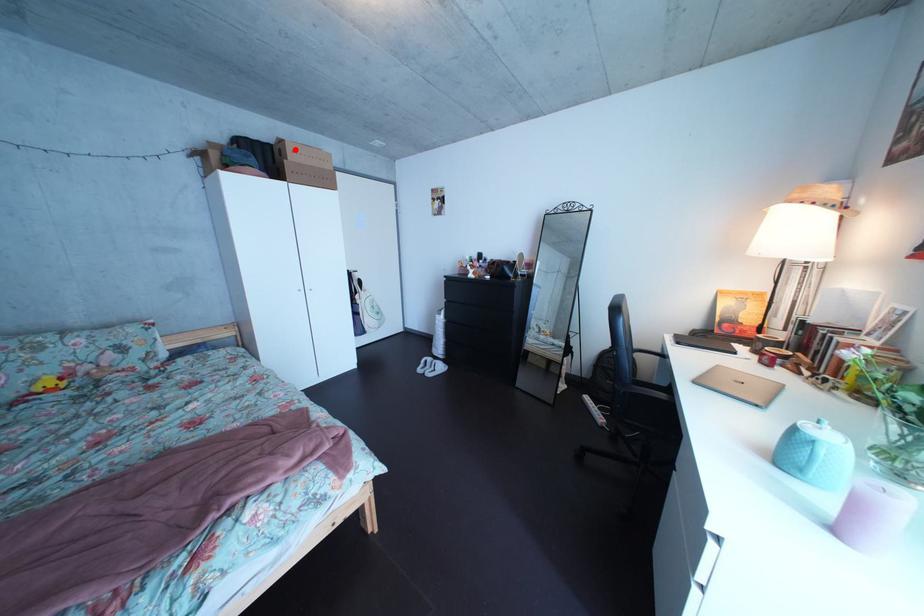
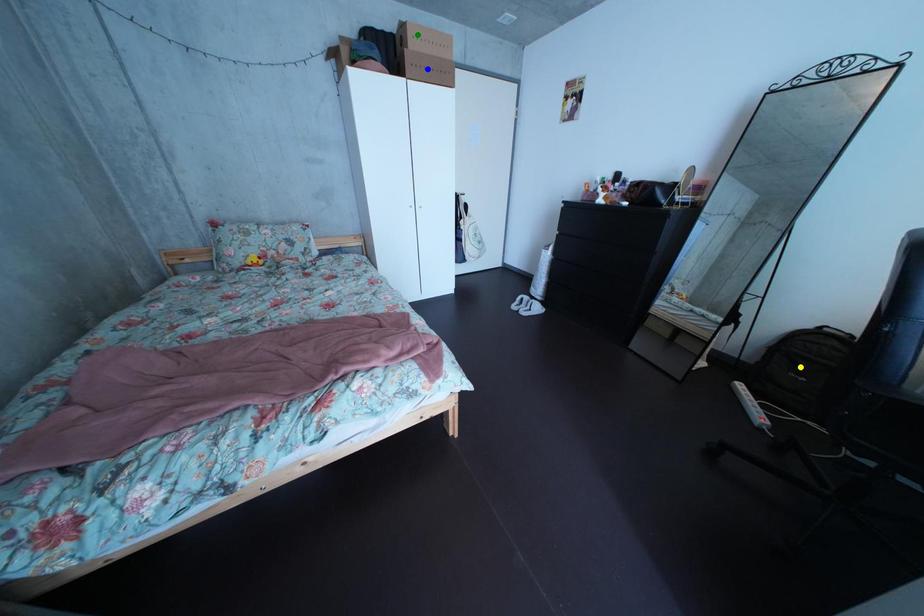
Question: I am providing you with two images of the same scene from different viewpoints. A red point is marked on the first image. You are given multiple points on the second image. Which point in image 2 is actually the same real-world point as the red point in image 1?

Choices:
 (A) yellow point
 (B) blue point
 (C) green point

Answer: (C)